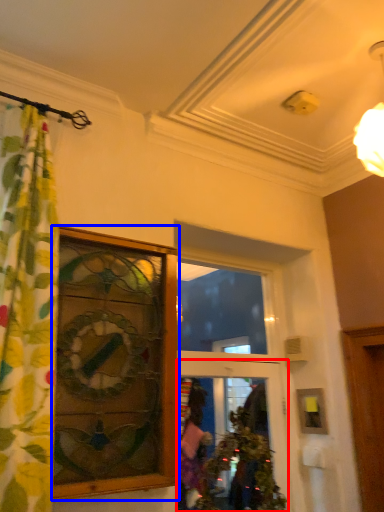
Question: Among these objects, which one is nearest to the camera, door (highlighted by a red box) or window (highlighted by a blue box)?

Choices:
 (A) door
 (B) window

Answer: (B)